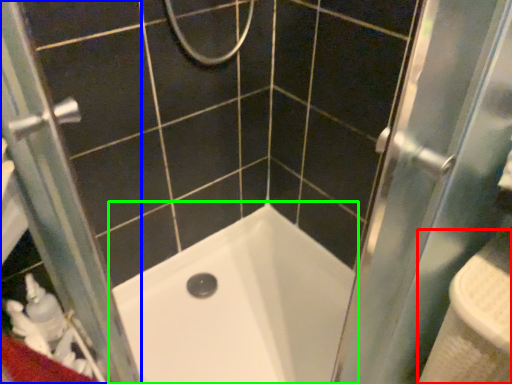
Question: Which is nearer to the sink (highlighted by a red box)? screen door (highlighted by a blue box) or bathtub (highlighted by a green box).

Choices:
 (A) screen door
 (B) bathtub

Answer: (B)